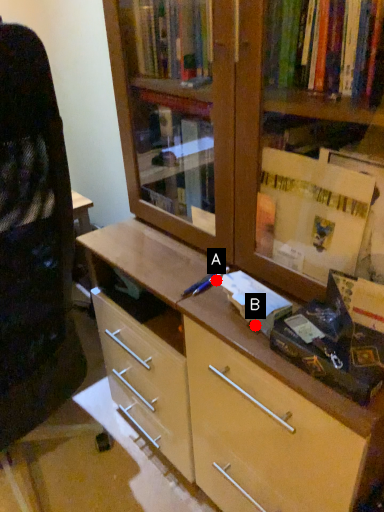
Question: Two points are circled on the image, labeled by A and B beside each circle. Which point is closer to the camera taking this photo?

Choices:
 (A) A is closer
 (B) B is closer

Answer: (B)